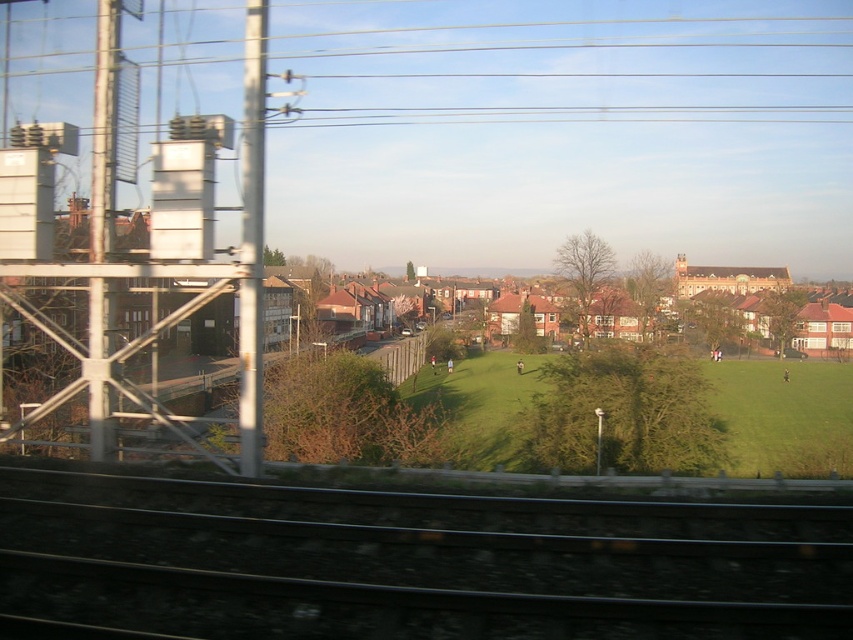
Measure the distance between point (x=134, y=513) and camera.

7.49 meters

Does black metal track at bottom have a greater width compared to green grass field at center?

No.

The height and width of the screenshot is (640, 853). Find the location of `black metal track at bottom`. black metal track at bottom is located at coordinates coord(407,563).